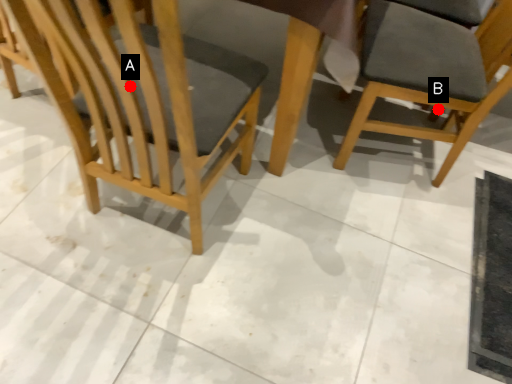
Question: Two points are circled on the image, labeled by A and B beside each circle. Among these points, which one is farthest from the camera?

Choices:
 (A) A is further
 (B) B is further

Answer: (B)